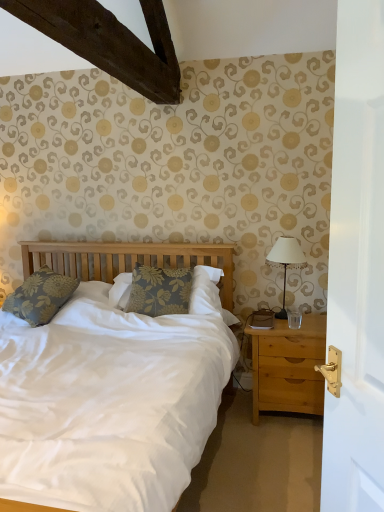
Question: Can you confirm if transparent glass at right is positioned to the right of floral fabric pillow at center, marked as the 2th pillow in a left-to-right arrangement?

Choices:
 (A) no
 (B) yes

Answer: (B)

Question: From a real-world perspective, is transparent glass at right positioned under floral fabric pillow at center, marked as the 2th pillow in a left-to-right arrangement, based on gravity?

Choices:
 (A) yes
 (B) no

Answer: (A)

Question: Is transparent glass at right at the left side of floral fabric pillow at center, the 1th pillow from the right?

Choices:
 (A) no
 (B) yes

Answer: (A)

Question: Is transparent glass at right next to floral fabric pillow at center, marked as the 2th pillow in a left-to-right arrangement?

Choices:
 (A) no
 (B) yes

Answer: (A)

Question: From the image's perspective, would you say transparent glass at right is shown under floral fabric pillow at center, the 1th pillow from the right?

Choices:
 (A) yes
 (B) no

Answer: (A)

Question: Is transparent glass at right in front of or behind floral fabric pillow at center, marked as the 2th pillow in a left-to-right arrangement, in the image?

Choices:
 (A) behind
 (B) front

Answer: (B)

Question: Considering the positions of transparent glass at right and floral fabric pillow at center, the 1th pillow from the right, in the image, is transparent glass at right wider or thinner than floral fabric pillow at center, the 1th pillow from the right,?

Choices:
 (A) thin
 (B) wide

Answer: (A)

Question: Based on their sizes in the image, would you say transparent glass at right is bigger or smaller than floral fabric pillow at center, the 1th pillow from the right?

Choices:
 (A) big
 (B) small

Answer: (B)

Question: Based on their positions, is transparent glass at right located to the left or right of floral fabric pillow at center, marked as the 2th pillow in a left-to-right arrangement?

Choices:
 (A) left
 (B) right

Answer: (B)

Question: Is point coord(294,266) positioned closer to the camera than point coord(299,323)?

Choices:
 (A) closer
 (B) farther

Answer: (B)

Question: Is white fabric-covered lamp at right taller or shorter than transparent glass at right?

Choices:
 (A) tall
 (B) short

Answer: (A)

Question: From the image's perspective, relative to transparent glass at right, is white fabric-covered lamp at right above or below?

Choices:
 (A) below
 (B) above

Answer: (B)

Question: Choose the correct answer: Is white fabric-covered lamp at right inside transparent glass at right or outside it?

Choices:
 (A) inside
 (B) outside

Answer: (B)

Question: Based on their sizes in the image, would you say white fabric-covered lamp at right is bigger or smaller than floral fabric pillow at left, the second pillow positioned from the right?

Choices:
 (A) small
 (B) big

Answer: (A)

Question: From the image's perspective, relative to floral fabric pillow at left, which is counted as the first pillow, starting from the left, is white fabric-covered lamp at right above or below?

Choices:
 (A) above
 (B) below

Answer: (A)